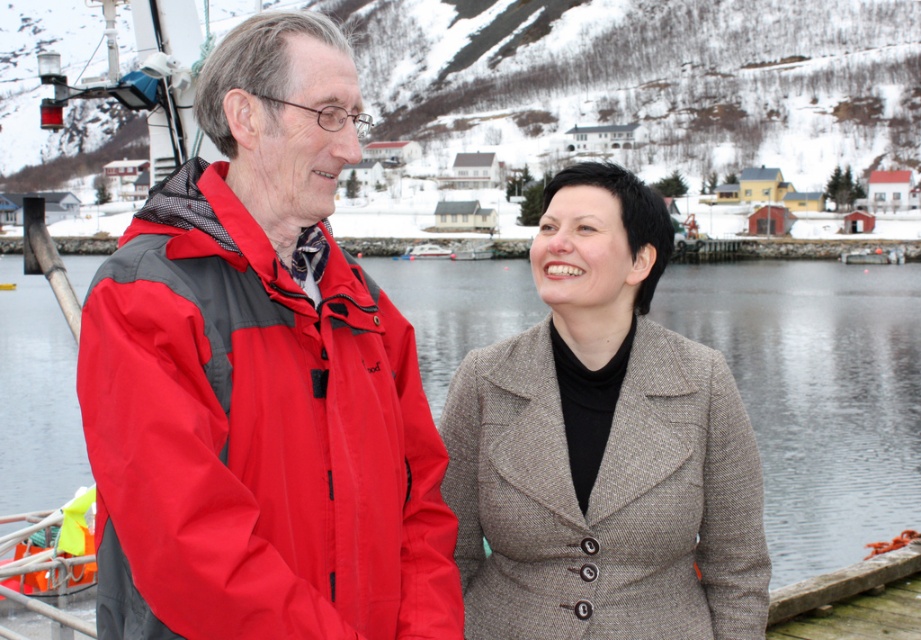
You are a fashion stylist observing two people in the scene. The matte red jacket at left and the brown woolen coat at center are both winter wear. Which of these two coats is shorter in length?

The matte red jacket at left is shorter than the brown woolen coat at center.

You are a photographer trying to capture a photo of the brown woolen coat at center without including the matte red jacket at left. Based on their positions, can you position yourself in a way to achieve this?

The matte red jacket at left is to the left of the brown woolen coat at center. To exclude the matte red jacket at left from the photo, position yourself to the right side of the brown woolen coat at center so that the matte red jacket at left is out of frame.